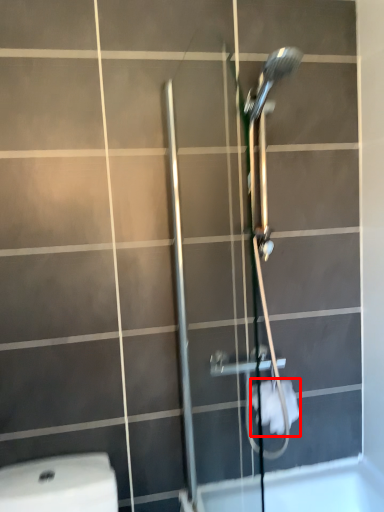
Question: From the image, what is the correct spatial relationship of toilet paper (annotated by the red box) in relation to shower door?

Choices:
 (A) left
 (B) right

Answer: (B)